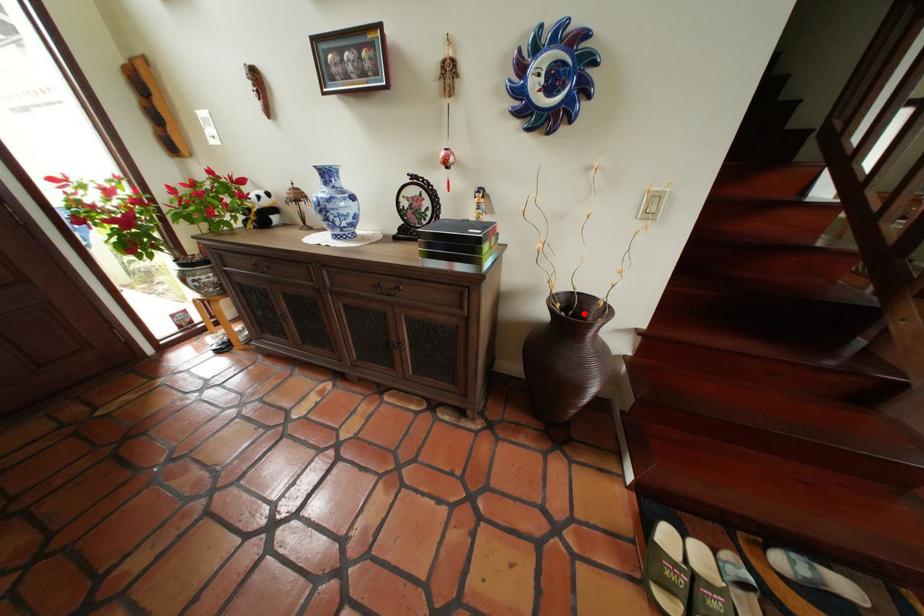
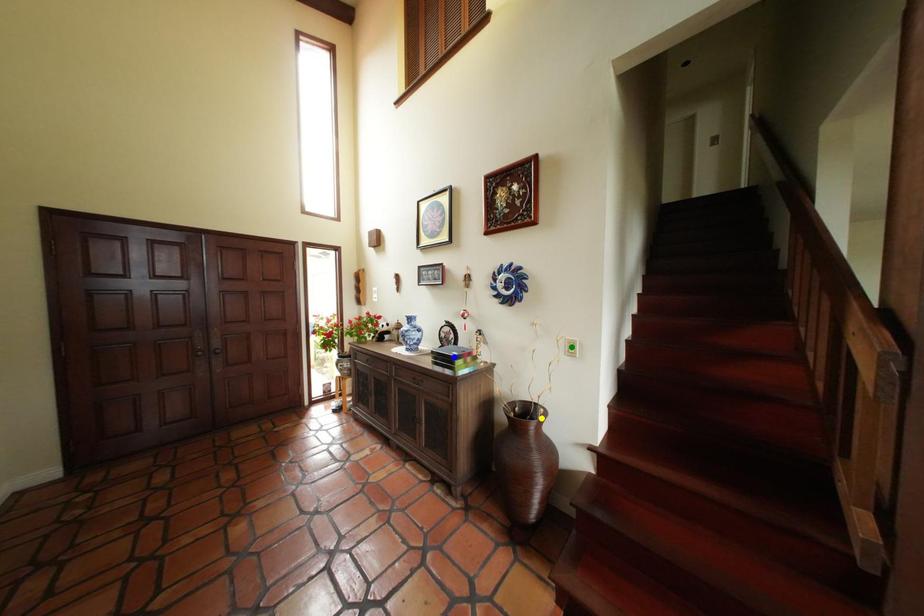
Question: I am providing you with two images of the same scene from different viewpoints. A red point is marked on the first image. You are given multiple points on the second image. Which spot in image 2 lines up with the point in image 1?

Choices:
 (A) blue point
 (B) yellow point
 (C) green point

Answer: (B)